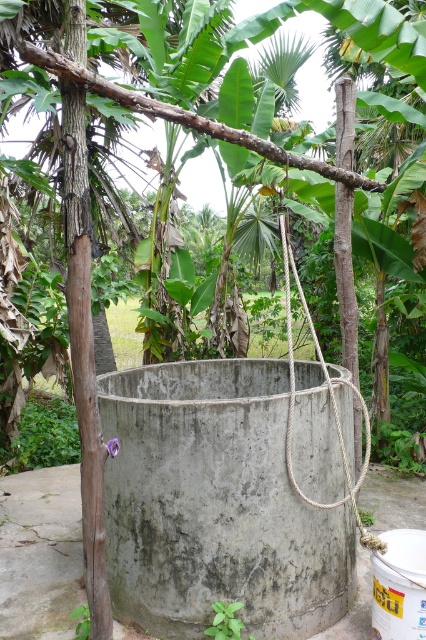
You are a farmer who needs to lower the gray concrete bucket at center into the well using the roperoughrope at center. Can you safely lower the bucket without the rope breaking?

The gray concrete bucket at center is thinner than the roperoughrope at center, so the bucket can be safely lowered as the rope is thicker and more durable.

You are standing at point (40, 552) in the scene. What object is located at your current position?

The gray concrete bucket at center is located at point (40, 552).